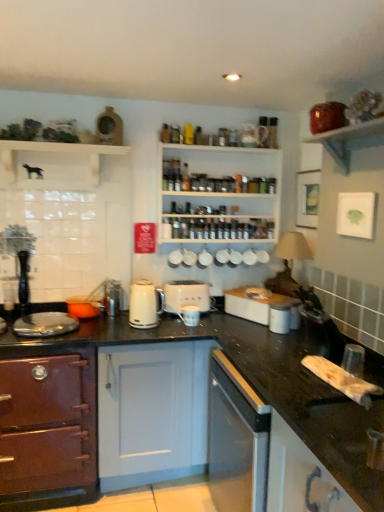
Question: Is matte purple oven at lower left, the 1th cabinetry viewed from the left, turned away from matte orange pot at left, the 1th appliance in the left-to-right sequence?

Choices:
 (A) yes
 (B) no

Answer: (B)

Question: From the image's perspective, is matte purple oven at lower left, which appears as the second cabinetry when viewed from the right, located beneath matte orange pot at left, which is the fourth appliance in right-to-left order?

Choices:
 (A) yes
 (B) no

Answer: (A)

Question: Is matte purple oven at lower left, the first cabinetry when ordered from back to front, located outside matte orange pot at left, the 1th appliance in the left-to-right sequence?

Choices:
 (A) yes
 (B) no

Answer: (A)

Question: Is the position of matte purple oven at lower left, the first cabinetry when ordered from back to front, more distant than that of matte orange pot at left, the 1th appliance in the left-to-right sequence?

Choices:
 (A) no
 (B) yes

Answer: (A)

Question: From a real-world perspective, is matte purple oven at lower left, the 1th cabinetry viewed from the left, located beneath matte orange pot at left, which is the fourth appliance in right-to-left order?

Choices:
 (A) no
 (B) yes

Answer: (B)

Question: Is matte purple oven at lower left, which ranks as the second cabinetry in front-to-back order, thinner than matte orange pot at left, which is the fourth appliance in right-to-left order?

Choices:
 (A) yes
 (B) no

Answer: (B)

Question: Is white glossy kettle at center further to the viewer compared to black granite countertop at center?

Choices:
 (A) no
 (B) yes

Answer: (B)

Question: Can you confirm if white glossy kettle at center is thinner than black granite countertop at center?

Choices:
 (A) no
 (B) yes

Answer: (B)

Question: Can you confirm if white glossy kettle at center is positioned to the right of black granite countertop at center?

Choices:
 (A) yes
 (B) no

Answer: (B)

Question: Does white glossy kettle at center have a lesser height compared to black granite countertop at center?

Choices:
 (A) yes
 (B) no

Answer: (A)

Question: Does white glossy kettle at center have a greater height compared to black granite countertop at center?

Choices:
 (A) no
 (B) yes

Answer: (A)

Question: Is white glossy kettle at center positioned in front of black granite countertop at center?

Choices:
 (A) yes
 (B) no

Answer: (B)

Question: Is white matte dog at upper left, which is the first shelf from left to right, to the left of matte purple oven at lower left, the first cabinetry when ordered from back to front, from the viewer's perspective?

Choices:
 (A) yes
 (B) no

Answer: (B)